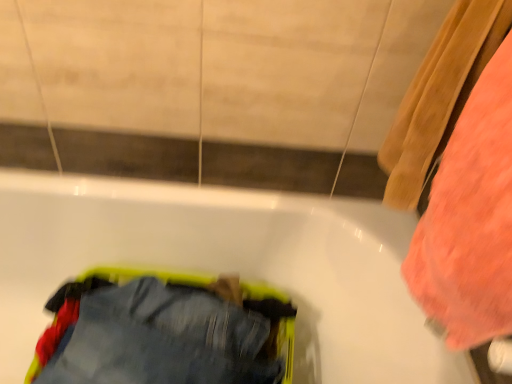
Question: Would you say denim pants at lower left is outside white glossy bathtub at center?

Choices:
 (A) no
 (B) yes

Answer: (A)

Question: Would you say white glossy bathtub at center is part of denim pants at lower left's contents?

Choices:
 (A) no
 (B) yes

Answer: (A)

Question: Does denim pants at lower left have a smaller size compared to white glossy bathtub at center?

Choices:
 (A) yes
 (B) no

Answer: (A)

Question: Can you confirm if denim pants at lower left is taller than white glossy bathtub at center?

Choices:
 (A) no
 (B) yes

Answer: (A)

Question: Is denim pants at lower left oriented away from white glossy bathtub at center?

Choices:
 (A) yes
 (B) no

Answer: (A)

Question: From their relative heights in the image, would you say denim pants at lower left is taller or shorter than fluffy coral towel at right?

Choices:
 (A) short
 (B) tall

Answer: (A)

Question: From a real-world perspective, is denim pants at lower left above or below fluffy coral towel at right?

Choices:
 (A) above
 (B) below

Answer: (B)

Question: In terms of width, does denim pants at lower left look wider or thinner when compared to fluffy coral towel at right?

Choices:
 (A) wide
 (B) thin

Answer: (A)

Question: In the image, is denim pants at lower left positioned in front of or behind fluffy coral towel at right?

Choices:
 (A) front
 (B) behind

Answer: (B)

Question: Relative to white glossy bathtub at center, is denim pants at lower left in front or behind?

Choices:
 (A) behind
 (B) front

Answer: (A)

Question: From their relative heights in the image, would you say denim pants at lower left is taller or shorter than white glossy bathtub at center?

Choices:
 (A) tall
 (B) short

Answer: (B)

Question: Considering the relative positions of denim pants at lower left and white glossy bathtub at center in the image provided, is denim pants at lower left to the left or to the right of white glossy bathtub at center?

Choices:
 (A) left
 (B) right

Answer: (B)

Question: Do you think denim pants at lower left is within white glossy bathtub at center, or outside of it?

Choices:
 (A) outside
 (B) inside

Answer: (B)

Question: Is fluffy coral towel at right in front of or behind denim pants at lower left in the image?

Choices:
 (A) behind
 (B) front

Answer: (B)

Question: In terms of width, does fluffy coral towel at right look wider or thinner when compared to denim pants at lower left?

Choices:
 (A) wide
 (B) thin

Answer: (B)